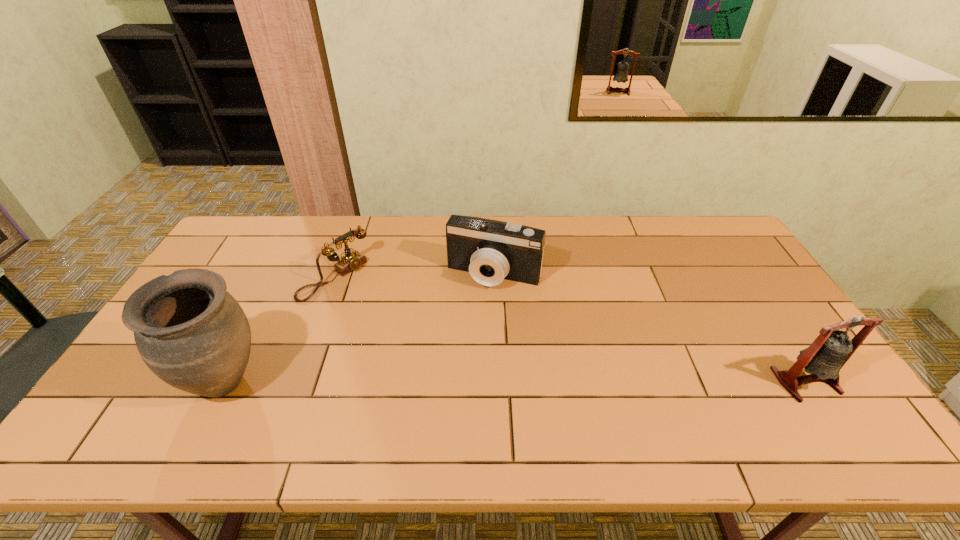
Locate an element on the screen. Image resolution: width=960 pixels, height=540 pixels. vacant position in the image that satisfies the following two spatial constraints: 1. on the back side of the second object from right to left; 2. on the left side of the shortest object is located at coordinates (335, 275).